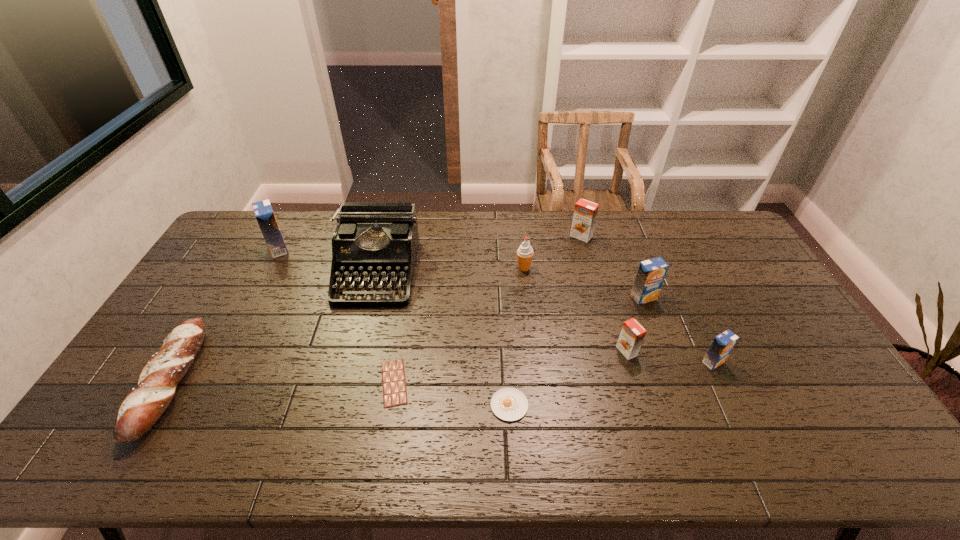
Find the location of a particular element. The height and width of the screenshot is (540, 960). baguet is located at coordinates (140, 410).

At what (x,y) coordinates should I click in order to perform the action: click on the leftmost object. Please return your answer as a coordinate pair (x, y). This screenshot has width=960, height=540. Looking at the image, I should click on 140,410.

Where is `egg yolk`? This screenshot has width=960, height=540. egg yolk is located at coordinates (509, 404).

Where is `white egg yolk`? The width and height of the screenshot is (960, 540). white egg yolk is located at coordinates (509, 404).

This screenshot has width=960, height=540. What are the coordinates of `chocolate bar` in the screenshot? It's located at (393, 373).

This screenshot has width=960, height=540. I want to click on vacant area situated 0.080m on the left of the leftmost blue orange_juice, so click(244, 249).

This screenshot has height=540, width=960. What are the coordinates of `free region located 0.320m on the typing side of the black typewriter` in the screenshot? It's located at (344, 397).

I want to click on blank space located 0.350m on the right of the bigger orange orange juice, so click(x=685, y=237).

The image size is (960, 540). Identify the location of vacant area situated 0.150m on the back of the second farthest blue orange_juice. (630, 260).

Find the location of `free region located 0.170m on the right of the red icecream`. free region located 0.170m on the right of the red icecream is located at coordinates (582, 268).